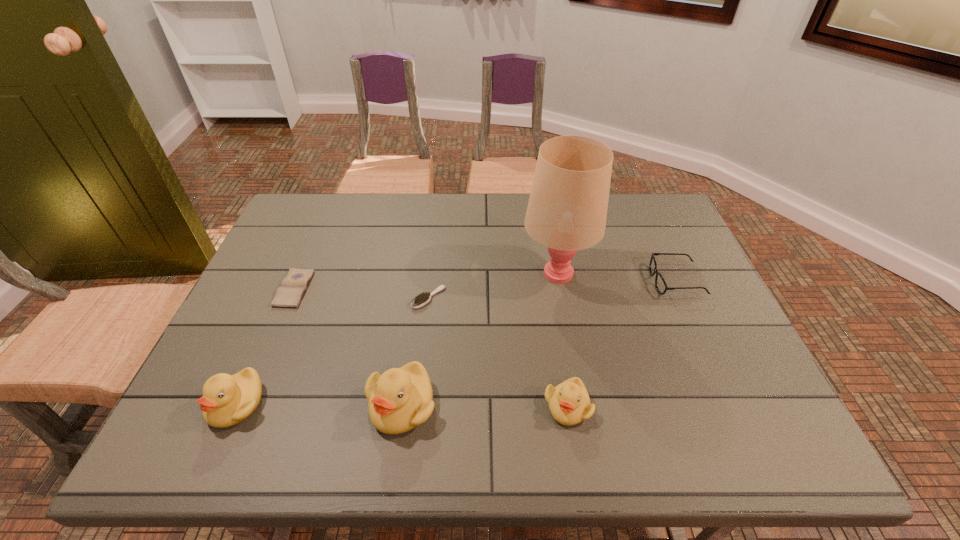
You are a GUI agent. You are given a task and a screenshot of the screen. Output one action in this format:
    pyautogui.click(x=<x>, y=<y>)
    Task: Click on the second shortest object
    
    Given the screenshot: What is the action you would take?
    pyautogui.click(x=419, y=301)

Where is `vacant region located on the left of the tallest object`? The image size is (960, 540). vacant region located on the left of the tallest object is located at coordinates (452, 273).

You are a GUI agent. You are given a task and a screenshot of the screen. Output one action in this format:
    pyautogui.click(x=<x>, y=<y>)
    Task: Click on the vacant region located 0.360m on the back of the shortest object
    
    Given the screenshot: What is the action you would take?
    pyautogui.click(x=332, y=199)

The image size is (960, 540). I want to click on vacant space located 0.140m on the front-facing side of the spectacles, so click(601, 281).

In order to click on blank space located on the front-facing side of the spectacles in this screenshot , I will do `click(564, 281)`.

Where is `vacant region located 0.140m on the front-facing side of the spectacles`? This screenshot has width=960, height=540. vacant region located 0.140m on the front-facing side of the spectacles is located at coordinates (601, 281).

Identify the location of free space located on the right of the sixth tallest object. point(551,298).

Image resolution: width=960 pixels, height=540 pixels. What are the coordinates of `duckling that is at the left edge` in the screenshot? It's located at (227, 400).

At what (x,y) coordinates should I click in order to perform the action: click on diary at the left edge. Please return your answer as a coordinate pair (x, y). Looking at the image, I should click on (289, 294).

Identify the location of object that is positioned at the right edge. The image size is (960, 540). (661, 286).